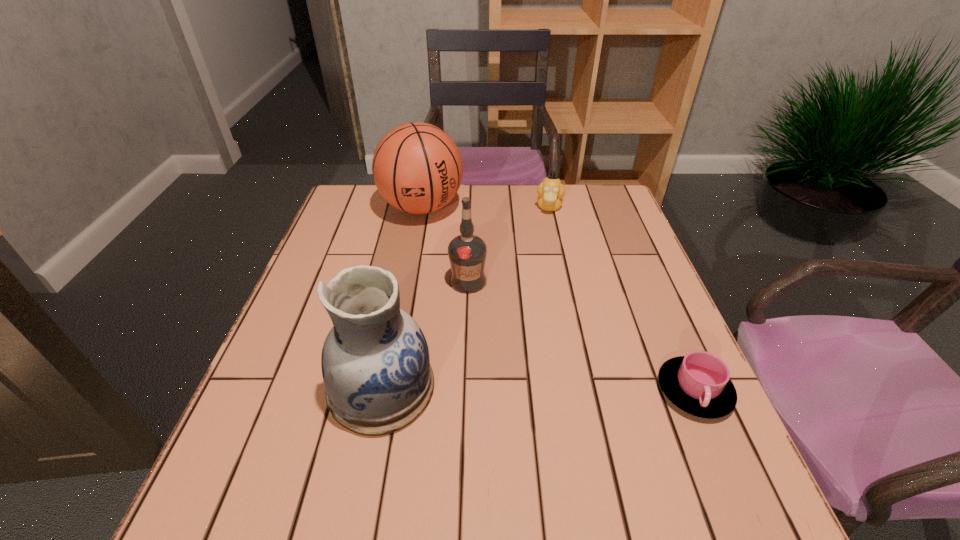
The image size is (960, 540). Find the location of `vacant space located 0.090m on the surface of the basketball near the brand logo`. vacant space located 0.090m on the surface of the basketball near the brand logo is located at coordinates (445, 247).

This screenshot has height=540, width=960. Identify the location of free location located on the surface of the basketball near the brand logo. (456, 266).

Identify the location of vacant space situated on the front label of the third farthest object. The height and width of the screenshot is (540, 960). (501, 328).

Where is `vacant position located on the front label of the third farthest object`? Image resolution: width=960 pixels, height=540 pixels. vacant position located on the front label of the third farthest object is located at coordinates (485, 306).

Where is `free space located 0.400m on the front label of the third farthest object`? free space located 0.400m on the front label of the third farthest object is located at coordinates (x=568, y=427).

Image resolution: width=960 pixels, height=540 pixels. I want to click on blank space located on the face of the duckling, so click(x=543, y=258).

You are a GUI agent. You are given a task and a screenshot of the screen. Output one action in this format:
    pyautogui.click(x=<x>, y=<y>)
    Task: Click on the blank area located on the face of the duckling
    
    Given the screenshot: What is the action you would take?
    pyautogui.click(x=538, y=301)

Locate an element on the screen. This screenshot has height=540, width=960. vacant space located 0.220m on the face of the duckling is located at coordinates (542, 262).

Where is `basketball at the far edge`? basketball at the far edge is located at coordinates (417, 168).

At what (x,y) coordinates should I click in order to perform the action: click on duckling at the far edge. Please return your answer as a coordinate pair (x, y). This screenshot has height=540, width=960. Looking at the image, I should click on (550, 192).